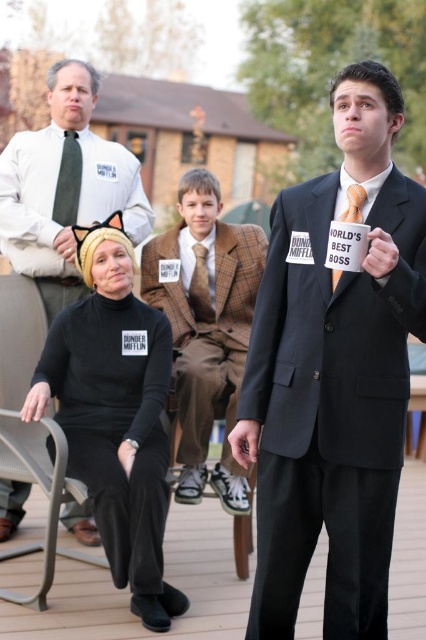
Based on the scene description, which object is positioned higher in the image? The black jersey at center or the metallic gray chair at lower left?

The black jersey at center is located above the metallic gray chair at lower left, so it is positioned higher in the image.

What is located at the coordinates point (115, 413)?

The black jersey at center is located at point (115, 413).